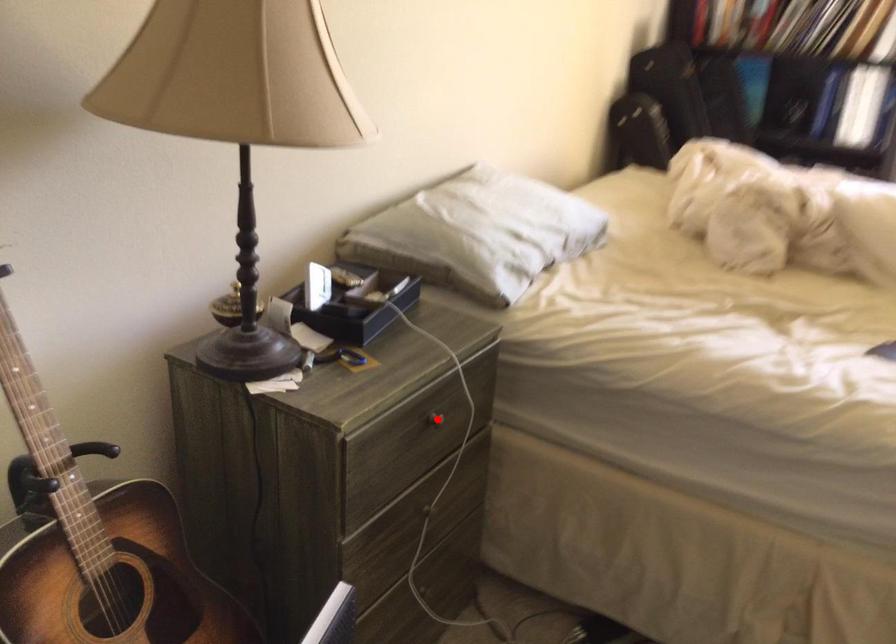
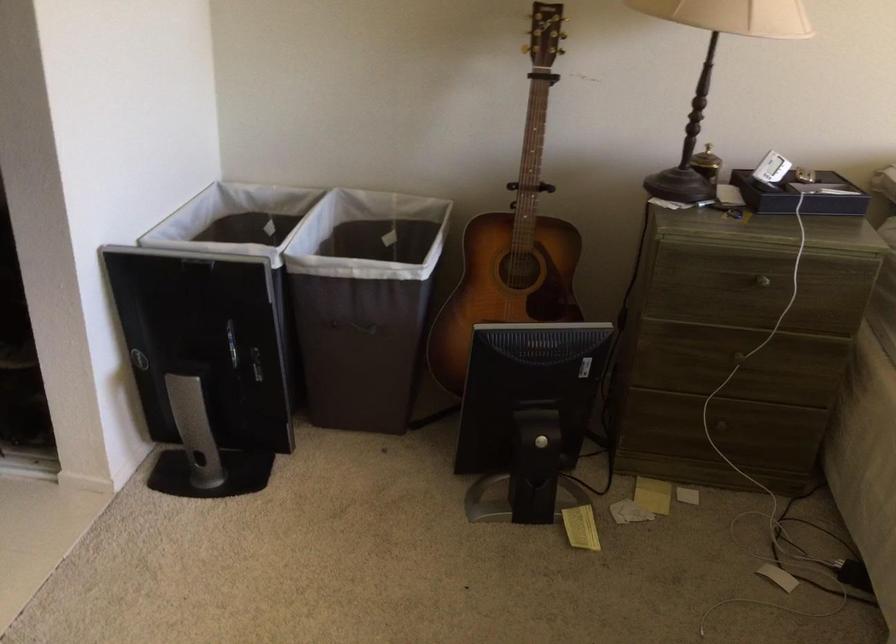
Question: A red point is marked in image1. In image2, is the corresponding 3D point closer to the camera or farther? Reply with the corresponding letter.

Choices:
 (A) The corresponding 3D point is closer.
 (B) The corresponding 3D point is farther.

Answer: (B)